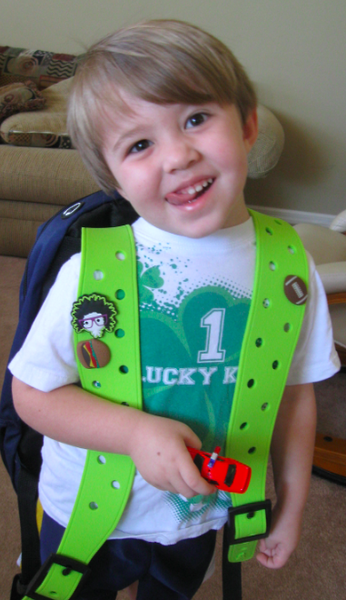
At what (x,y) coordinates should I click in order to perform the action: click on toy car. Please return your answer as a coordinate pair (x, y). Looking at the image, I should click on (240, 477).